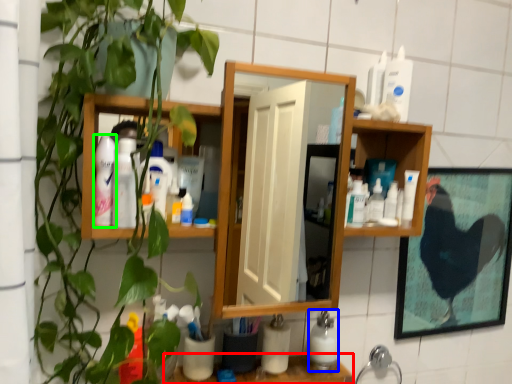
Question: Considering the real-world distances, which object is farthest from counter top (highlighted by a red box)? cleaning product (highlighted by a blue box) or toiletry (highlighted by a green box)?

Choices:
 (A) cleaning product
 (B) toiletry

Answer: (B)